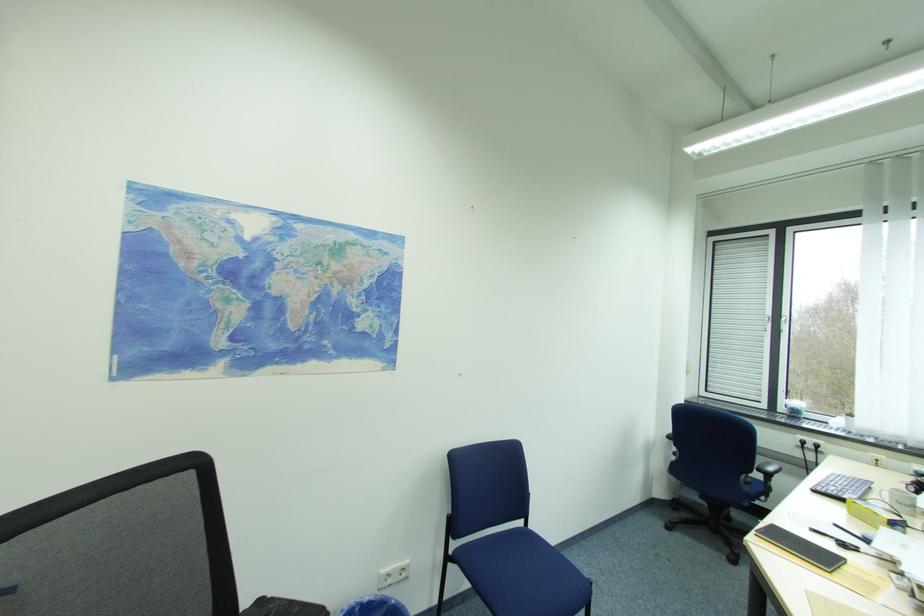
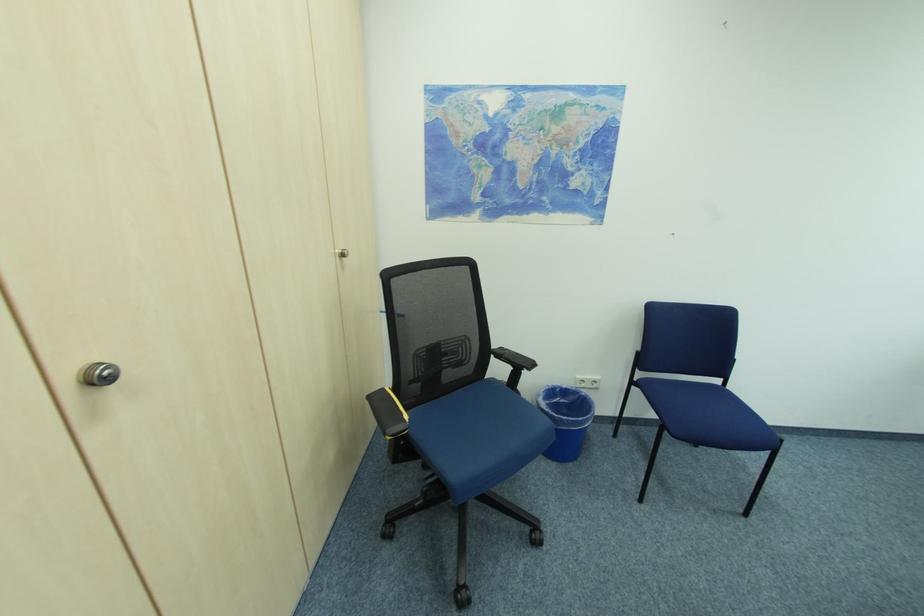
First-person continuous shooting, in which direction is the camera rotating?

The camera's rotation is toward left-down.